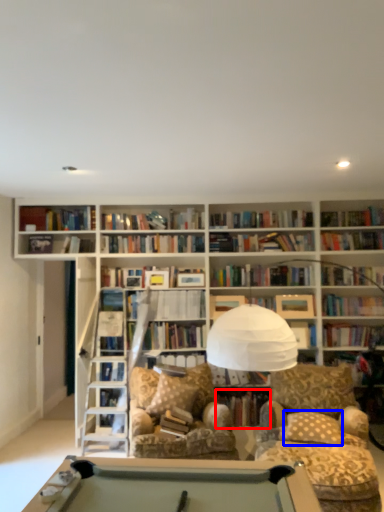
Question: Which point is closer to the camera, book (highlighted by a red box) or pillow (highlighted by a blue box)?

Choices:
 (A) book
 (B) pillow

Answer: (B)